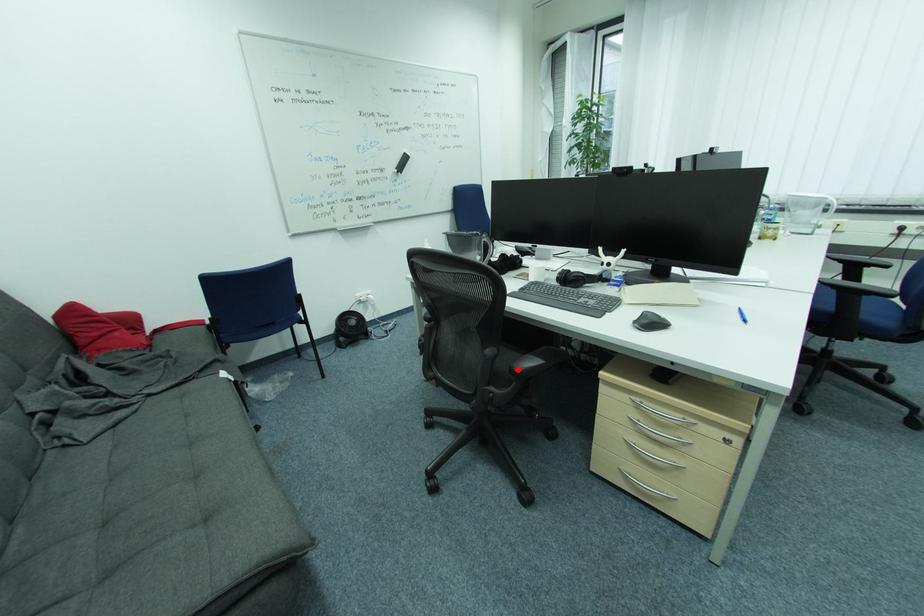
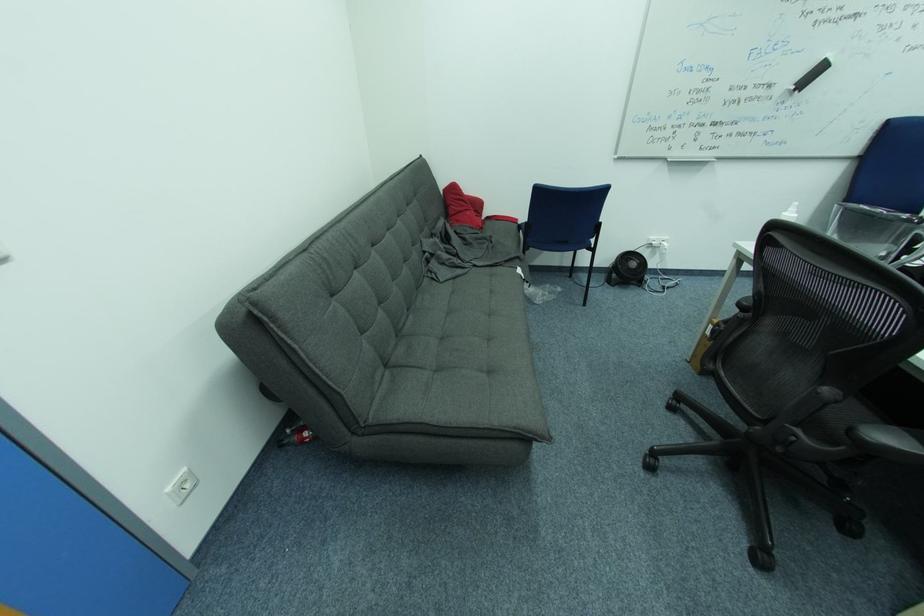
Find the pixel in the second image that matches the highlighted location in the first image.

(858, 430)